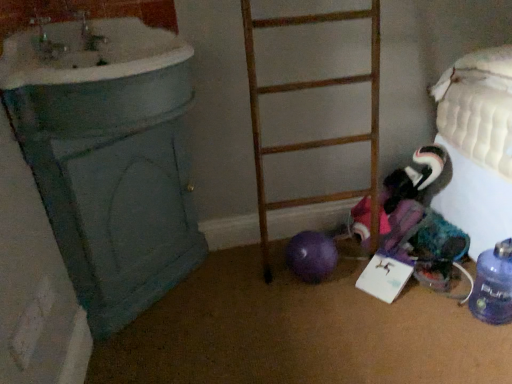
Question: Is the depth of blue translucent bottle at lower right greater than that of white glossy sink at upper left?

Choices:
 (A) no
 (B) yes

Answer: (B)

Question: Considering the relative sizes of blue translucent bottle at lower right and white glossy sink at upper left in the image provided, is blue translucent bottle at lower right wider than white glossy sink at upper left?

Choices:
 (A) no
 (B) yes

Answer: (A)

Question: Is blue translucent bottle at lower right directly adjacent to white glossy sink at upper left?

Choices:
 (A) no
 (B) yes

Answer: (A)

Question: From a real-world perspective, is blue translucent bottle at lower right positioned under white glossy sink at upper left based on gravity?

Choices:
 (A) no
 (B) yes

Answer: (B)

Question: Can you confirm if blue translucent bottle at lower right is bigger than white glossy sink at upper left?

Choices:
 (A) yes
 (B) no

Answer: (B)

Question: Can you confirm if blue translucent bottle at lower right is thinner than white glossy sink at upper left?

Choices:
 (A) yes
 (B) no

Answer: (A)

Question: Is wooden ladder at center taller than blue translucent bottle at lower right?

Choices:
 (A) no
 (B) yes

Answer: (B)

Question: Is wooden ladder at center turned away from blue translucent bottle at lower right?

Choices:
 (A) no
 (B) yes

Answer: (A)

Question: Is wooden ladder at center in front of blue translucent bottle at lower right?

Choices:
 (A) yes
 (B) no

Answer: (A)

Question: From a real-world perspective, does wooden ladder at center sit lower than blue translucent bottle at lower right?

Choices:
 (A) yes
 (B) no

Answer: (B)

Question: Is blue translucent bottle at lower right completely or partially inside wooden ladder at center?

Choices:
 (A) no
 (B) yes

Answer: (A)

Question: From a real-world perspective, is wooden ladder at center on blue translucent bottle at lower right?

Choices:
 (A) no
 (B) yes

Answer: (B)

Question: Can you confirm if wooden ladder at center is wider than white glossy sink at upper left?

Choices:
 (A) no
 (B) yes

Answer: (A)